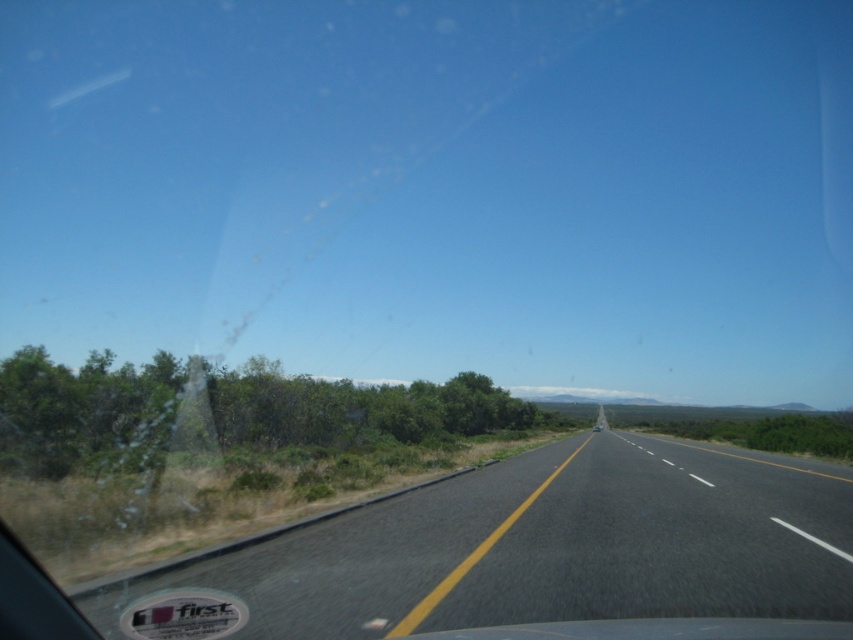
Is point (535, 545) positioned before point (479, 435)?

Yes.

Can you confirm if black asphalt road at center is positioned to the left of green leafy shrub at left?

No, black asphalt road at center is not to the left of green leafy shrub at left.

This screenshot has height=640, width=853. Describe the element at coordinates (531, 548) in the screenshot. I see `black asphalt road at center` at that location.

This screenshot has width=853, height=640. In order to click on black asphalt road at center in this screenshot , I will do `click(531, 548)`.